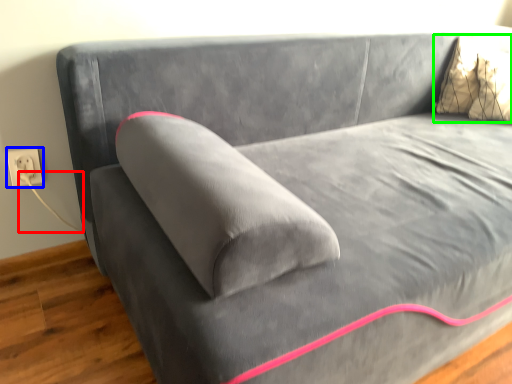
Question: Which object is positioned closest to string (highlighted by a red box)? Select from electric outlet (highlighted by a blue box) and pillow (highlighted by a green box).

Choices:
 (A) electric outlet
 (B) pillow

Answer: (A)